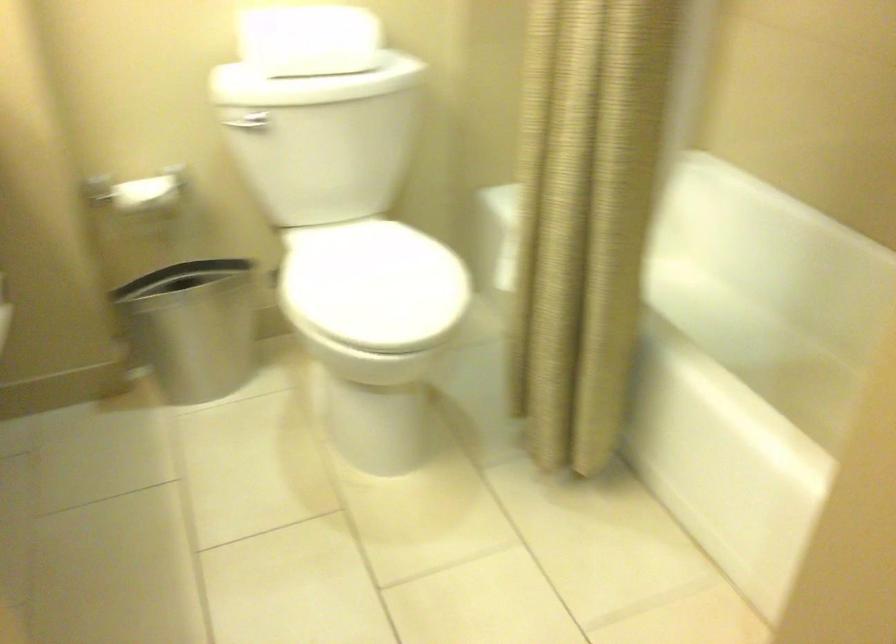
Locate an element on the screen. The width and height of the screenshot is (896, 644). toilet paper roll is located at coordinates (147, 193).